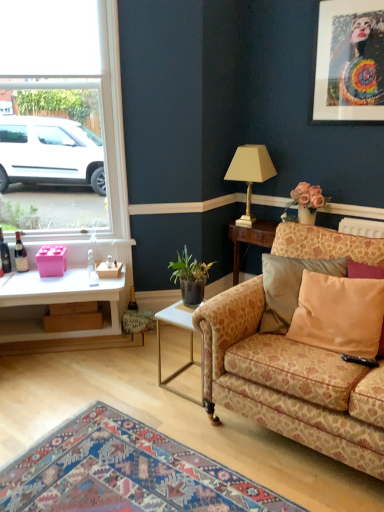
Identify the location of free location in front of brown cardboard box at lower left, placed as the 2th box when sorted from top to bottom. (62, 340).